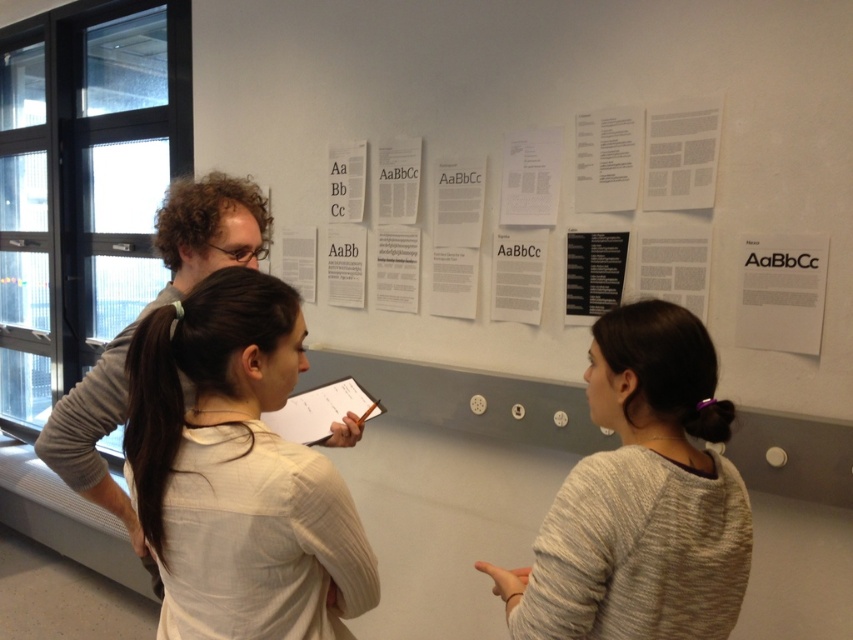
Does gray sweater at center appear under brown smooth hair at center?

Yes, gray sweater at center is below brown smooth hair at center.

Is gray sweater at center in front of brown smooth hair at center?

That is True.

Who is more forward, (x=639, y=490) or (x=161, y=476)?

Point (x=161, y=476)

I want to click on gray sweater at center, so click(641, 499).

What do you see at coordinates (641, 499) in the screenshot? Image resolution: width=853 pixels, height=640 pixels. I see `gray sweater at center` at bounding box center [641, 499].

Is gray sweater at center below white paper at right?

Yes.

Who is more distant from viewer, (726, 435) or (807, 330)?

The point (807, 330) is more distant.

Image resolution: width=853 pixels, height=640 pixels. I want to click on gray sweater at center, so click(x=641, y=499).

Is the position of white fabric shirt at center less distant than that of white paper at right?

That is True.

Between white fabric shirt at center and white paper at right, which one has more height?

white fabric shirt at center

Locate an element on the screen. The height and width of the screenshot is (640, 853). white fabric shirt at center is located at coordinates (238, 472).

Image resolution: width=853 pixels, height=640 pixels. Find the location of `white fabric shirt at center`. white fabric shirt at center is located at coordinates (238, 472).